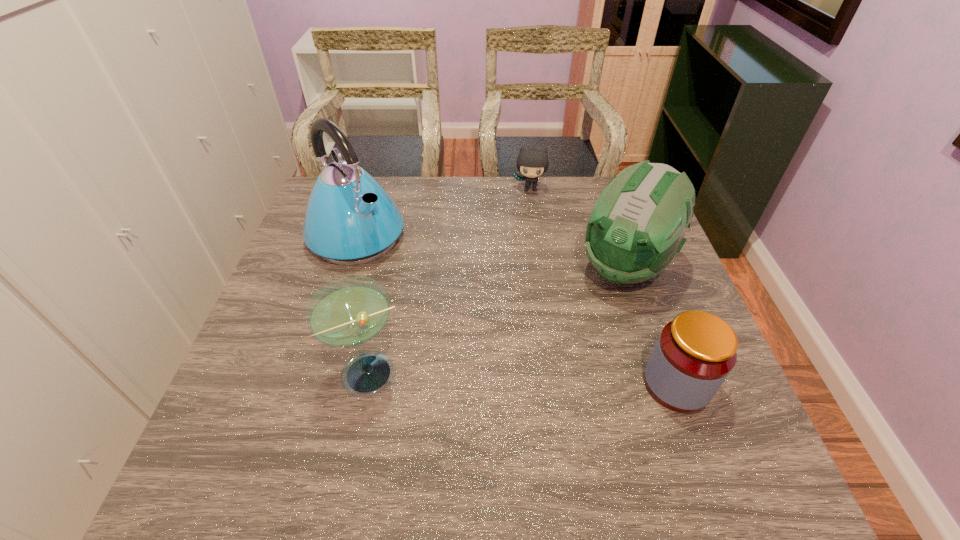
You are a GUI agent. You are given a task and a screenshot of the screen. Output one action in this format:
    pyautogui.click(x=<x>, y=<y>)
    Task: Click on the vacant space on the desktop that is between the third shortest object and the jar and is positioned on the visor of the football helmet
    The height and width of the screenshot is (540, 960).
    Given the screenshot: What is the action you would take?
    pyautogui.click(x=539, y=380)

Find the location of `vacant space on the desktop that is between the martini and the fourth tallest object and is positioned on the front-facing side of the third object from left to right`. vacant space on the desktop that is between the martini and the fourth tallest object and is positioned on the front-facing side of the third object from left to right is located at coordinates (516, 379).

Locate an element on the screen. This screenshot has height=540, width=960. free spot on the desktop that is between the martini and the jar and is positioned at the spout of the kettle is located at coordinates (528, 380).